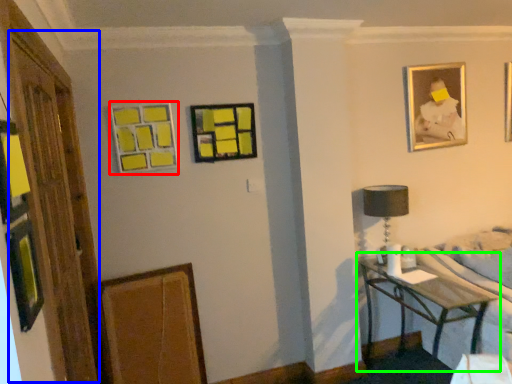
Question: Estimate the real-world distances between objects in this image. Which object is farther from picture frame (highlighted by a red box), glass door (highlighted by a blue box) or table (highlighted by a green box)?

Choices:
 (A) glass door
 (B) table

Answer: (B)